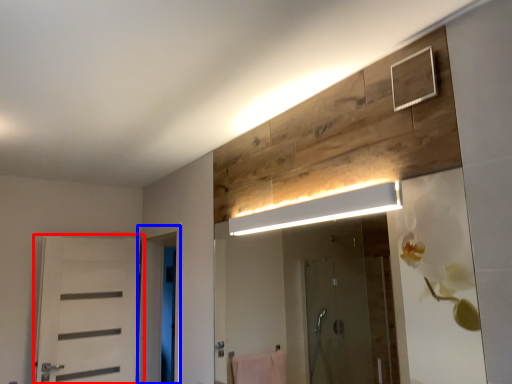
Question: Which object appears closest to the camera in this image, door (highlighted by a red box) or screen door (highlighted by a blue box)?

Choices:
 (A) door
 (B) screen door

Answer: (B)